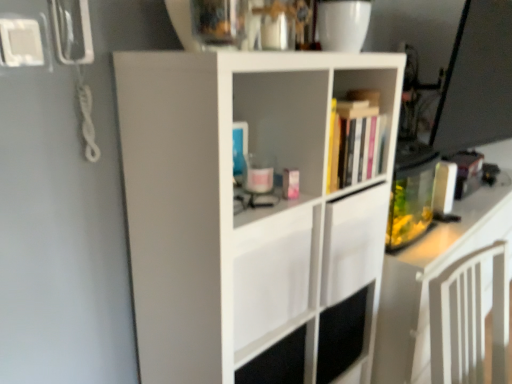
Question: Is white matte cupboard at center spatially inside hardcover books at upper center, or outside of it?

Choices:
 (A) outside
 (B) inside

Answer: (A)

Question: Considering the positions of white matte cupboard at center and hardcover books at upper center in the image, is white matte cupboard at center wider or thinner than hardcover books at upper center?

Choices:
 (A) wide
 (B) thin

Answer: (A)

Question: From their relative heights in the image, would you say white matte cupboard at center is taller or shorter than hardcover books at upper center?

Choices:
 (A) tall
 (B) short

Answer: (A)

Question: Considering the positions of hardcover books at upper center and white matte cupboard at center in the image, is hardcover books at upper center taller or shorter than white matte cupboard at center?

Choices:
 (A) tall
 (B) short

Answer: (B)

Question: Looking at the image, does hardcover books at upper center seem bigger or smaller compared to white matte cupboard at center?

Choices:
 (A) big
 (B) small

Answer: (B)

Question: Is hardcover books at upper center situated inside white matte cupboard at center or outside?

Choices:
 (A) outside
 (B) inside

Answer: (B)

Question: From a real-world perspective, is hardcover books at upper center physically located above or below white matte cupboard at center?

Choices:
 (A) below
 (B) above

Answer: (B)